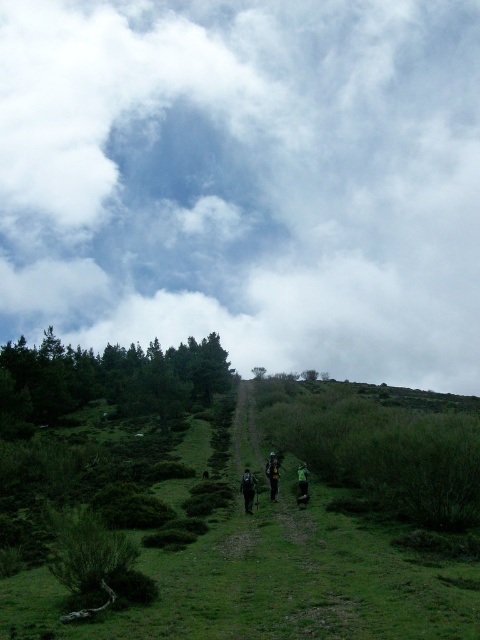
Question: Can you confirm if dark green grass at center is positioned above green fabric backpack at center?

Choices:
 (A) no
 (B) yes

Answer: (A)

Question: Which of the following is the closest to the observer?

Choices:
 (A) (348, 541)
 (B) (266, 468)
 (C) (384, 611)

Answer: (C)

Question: Is camouflage fabric backpack at center wider than green fabric backpack at center?

Choices:
 (A) yes
 (B) no

Answer: (B)

Question: Where is dark green backpack at center located in relation to camouflage fabric backpack at center in the image?

Choices:
 (A) left
 (B) right

Answer: (A)

Question: Which point is closer to the camera?

Choices:
 (A) green fabric backpack at center
 (B) green grassy at center

Answer: (B)

Question: Which point appears farthest from the camera in this image?

Choices:
 (A) (242, 602)
 (B) (276, 474)
 (C) (251, 484)
 (D) (280, 48)

Answer: (D)